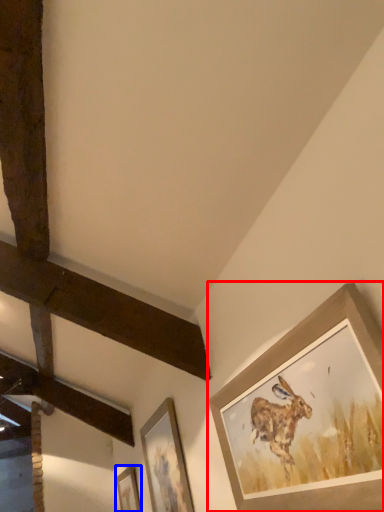
Question: Which object appears closest to the camera in this image, picture frame (highlighted by a red box) or picture frame (highlighted by a blue box)?

Choices:
 (A) picture frame
 (B) picture frame

Answer: (A)